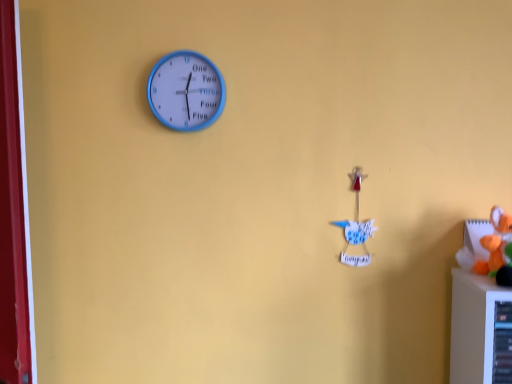
Question: Is orange plush toy at right, which ranks as the 1th toy in right-to-left order, taller than white paper bird at center-right, the 1th toy in the back-to-front sequence?

Choices:
 (A) yes
 (B) no

Answer: (B)

Question: From a real-world perspective, is orange plush toy at right, which appears as the second toy when viewed from the back, located higher than white paper bird at center-right, acting as the 2th toy starting from the right?

Choices:
 (A) no
 (B) yes

Answer: (A)

Question: From the image's perspective, would you say orange plush toy at right, which ranks as the 1th toy in right-to-left order, is positioned over white paper bird at center-right, positioned as the 2th toy in front-to-back order?

Choices:
 (A) no
 (B) yes

Answer: (A)

Question: Does orange plush toy at right, which ranks as the 1th toy in front-to-back order, appear on the left side of white paper bird at center-right, acting as the 2th toy starting from the right?

Choices:
 (A) yes
 (B) no

Answer: (B)

Question: Is orange plush toy at right, which ranks as the 1th toy in right-to-left order, positioned beyond the bounds of white paper bird at center-right, acting as the 2th toy starting from the right?

Choices:
 (A) no
 (B) yes

Answer: (B)

Question: Does orange plush toy at right, the second toy in the left-to-right sequence, turn towards white paper bird at center-right, acting as the 2th toy starting from the right?

Choices:
 (A) no
 (B) yes

Answer: (A)

Question: Is blue plastic clock at upper left surrounding orange plush toy at right, which appears as the second toy when viewed from the back?

Choices:
 (A) yes
 (B) no

Answer: (B)

Question: Could you tell me if blue plastic clock at upper left is turned towards orange plush toy at right, the second toy in the left-to-right sequence?

Choices:
 (A) no
 (B) yes

Answer: (A)

Question: Is blue plastic clock at upper left positioned beyond the bounds of orange plush toy at right, which ranks as the 1th toy in front-to-back order?

Choices:
 (A) no
 (B) yes

Answer: (B)

Question: From the image's perspective, is blue plastic clock at upper left above orange plush toy at right, which ranks as the 1th toy in right-to-left order?

Choices:
 (A) no
 (B) yes

Answer: (B)

Question: Is blue plastic clock at upper left turned away from orange plush toy at right, which ranks as the 1th toy in front-to-back order?

Choices:
 (A) no
 (B) yes

Answer: (A)

Question: Is blue plastic clock at upper left not near orange plush toy at right, which ranks as the 1th toy in right-to-left order?

Choices:
 (A) no
 (B) yes

Answer: (A)

Question: Considering the relative positions of blue plastic clock at upper left and white paper bird at center-right, which is counted as the first toy, starting from the left, in the image provided, is blue plastic clock at upper left in front of white paper bird at center-right, which is counted as the first toy, starting from the left,?

Choices:
 (A) no
 (B) yes

Answer: (A)